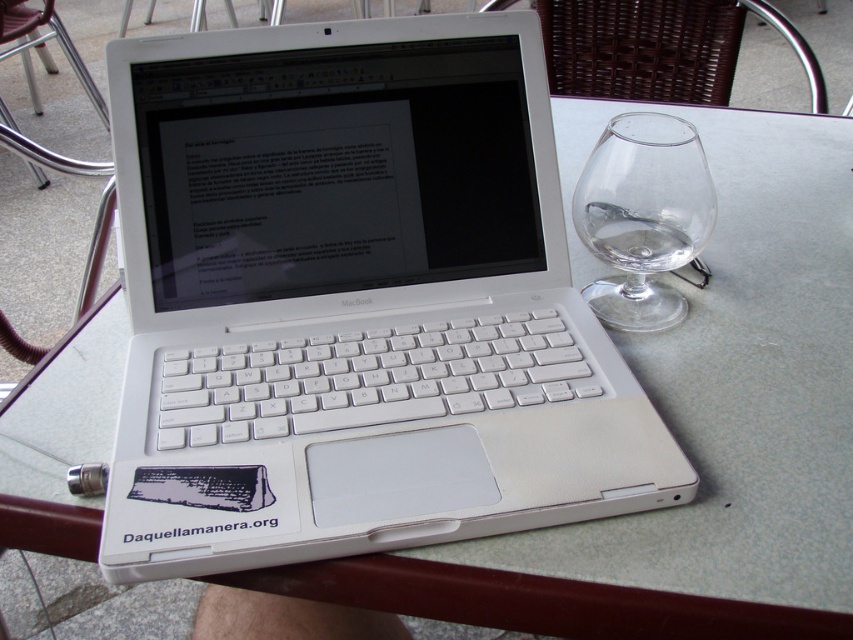
You are a delivery person who needs to place a small package between the white plastic laptop at center and the transparent glass wine glass at right on the table. Can the package fit in the space between them if the package is 15 cm wide?

The white plastic laptop at center is larger than the transparent glass wine glass at right, but the exact distance between them isn

You are a photographer setting up a shot of the white plastic laptop at center and the transparent glass wine glass at right. You need to ensure that the laptop appears significantly larger than the glass in the final image. Based on their actual sizes, is this arrangement feasible?

The white plastic laptop at center is much taller than the transparent glass wine glass at right, so arranging them in this way would naturally make the laptop appear significantly larger in the photo.

You are a photographer taking a closeup shot of the white plastic laptop at center and the transparent glass wine glass at right. Which object will appear larger in your photo?

The white plastic laptop at center will appear larger in the photo because it is closer to the viewer than the transparent glass wine glass at right.